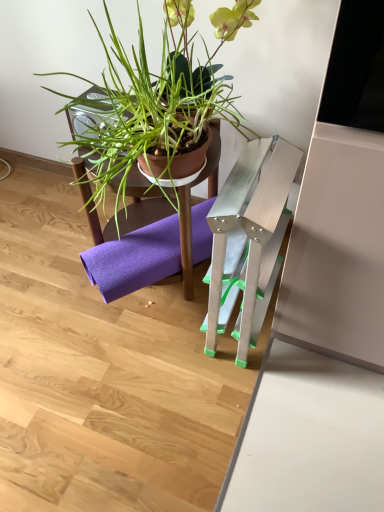
Question: Considering the relative positions of matte brown pot at center and brown matte plant pot at upper center in the image provided, is matte brown pot at center in front of brown matte plant pot at upper center?

Choices:
 (A) yes
 (B) no

Answer: (A)

Question: From a real-world perspective, is matte brown pot at center located higher than brown matte plant pot at upper center?

Choices:
 (A) no
 (B) yes

Answer: (B)

Question: From a real-world perspective, is matte brown pot at center physically below brown matte plant pot at upper center?

Choices:
 (A) yes
 (B) no

Answer: (B)

Question: Would you say matte brown pot at center is a long distance from brown matte plant pot at upper center?

Choices:
 (A) no
 (B) yes

Answer: (A)

Question: Is matte brown pot at center facing away from brown matte plant pot at upper center?

Choices:
 (A) no
 (B) yes

Answer: (A)

Question: Are matte brown pot at center and brown matte plant pot at upper center beside each other?

Choices:
 (A) yes
 (B) no

Answer: (B)

Question: Can you confirm if brown matte plant pot at upper center is thinner than matte brown pot at center?

Choices:
 (A) yes
 (B) no

Answer: (A)

Question: Is brown matte plant pot at upper center turned away from matte brown pot at center?

Choices:
 (A) yes
 (B) no

Answer: (B)

Question: Does brown matte plant pot at upper center appear on the left side of matte brown pot at center?

Choices:
 (A) no
 (B) yes

Answer: (A)

Question: Are brown matte plant pot at upper center and matte brown pot at center far apart?

Choices:
 (A) no
 (B) yes

Answer: (A)

Question: Is brown matte plant pot at upper center beside matte brown pot at center?

Choices:
 (A) yes
 (B) no

Answer: (B)

Question: Considering the relative positions of brown matte plant pot at upper center and matte brown pot at center in the image provided, is brown matte plant pot at upper center behind matte brown pot at center?

Choices:
 (A) yes
 (B) no

Answer: (A)

Question: From a real-world perspective, is purple fabric yoga mat at lower center located higher than brown matte plant pot at upper center?

Choices:
 (A) yes
 (B) no

Answer: (B)